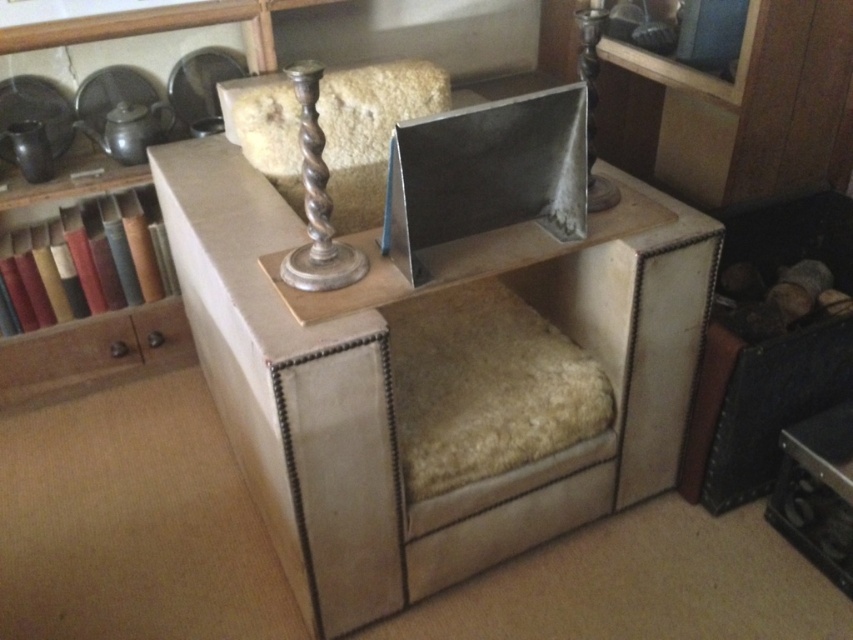
Question: Observing the image, what is the correct spatial positioning of brown wood drawer at left in reference to silver polished metal candlestick at upper center?

Choices:
 (A) right
 (B) left

Answer: (B)

Question: Which of the following is the closest to the observer?

Choices:
 (A) coord(4,339)
 (B) coord(309,177)

Answer: (B)

Question: Is brown wood drawer at left below silver polished metal candlestick at upper center?

Choices:
 (A) no
 (B) yes

Answer: (B)

Question: Observing the image, what is the correct spatial positioning of brown wood drawer at left in reference to silver polished metal candlestick at upper center?

Choices:
 (A) left
 (B) right

Answer: (A)